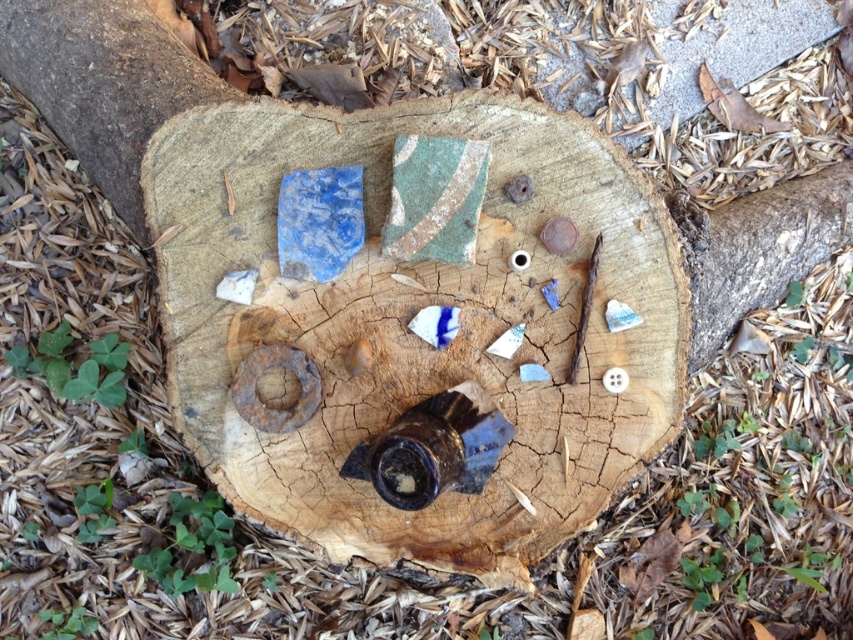
Is point (585, 502) in front of point (122, 140)?

Yes, point (585, 502) is closer to viewer.

Can you confirm if blue ceramic tile at center is positioned below brown rough wood at upper left?

Indeed, blue ceramic tile at center is positioned under brown rough wood at upper left.

Between point (473, 561) and point (172, 60), which one is positioned behind?

Positioned behind is point (172, 60).

You are a GUI agent. You are given a task and a screenshot of the screen. Output one action in this format:
    pyautogui.click(x=<x>, y=<y>)
    Task: Click on the blue ceramic tile at center
    Image resolution: width=853 pixels, height=640 pixels.
    Given the screenshot: What is the action you would take?
    pyautogui.click(x=410, y=317)